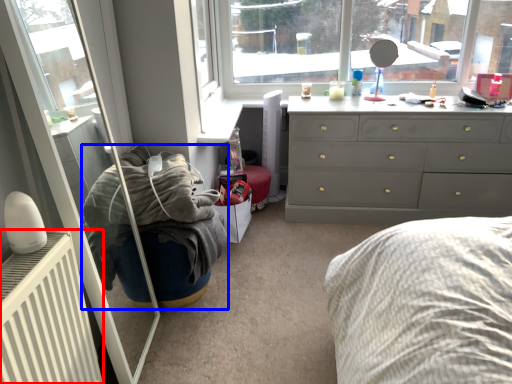
Question: Which object appears closest to the camera in this image, radiator (highlighted by a red box) or bean bag chair (highlighted by a blue box)?

Choices:
 (A) radiator
 (B) bean bag chair

Answer: (A)